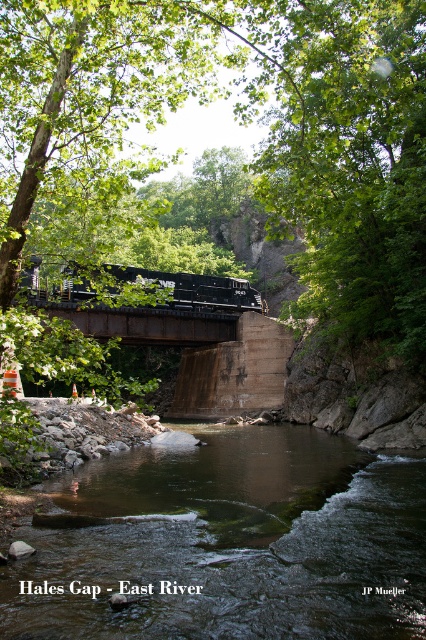
Is green leafy tree at upper center thinner than clear water at center?

No.

Between green leafy tree at upper center and clear water at center, which one is positioned higher?

green leafy tree at upper center is above.

Describe the element at coordinates (244, 116) in the screenshot. I see `green leafy tree at upper center` at that location.

Identify the location of green leafy tree at upper center. (244, 116).

Which is in front, point (324, 166) or point (71, 285)?

Point (324, 166) is more forward.

Does point (158, 99) lie behind point (138, 275)?

No, (158, 99) is closer to viewer.

Consider the image. Who is more distant from viewer, [394,184] or [180,289]?

The point [180,289] is more distant.

The image size is (426, 640). I want to click on green leafy tree at upper center, so click(x=244, y=116).

In the scene shown: Does clear water at center have a greater width compared to black metal train at center?

Incorrect, clear water at center's width does not surpass black metal train at center's.

Describe the element at coordinates (230, 545) in the screenshot. I see `clear water at center` at that location.

Does point (310, 467) come behind point (98, 298)?

No, it is not.

Identify the location of clear water at center. Image resolution: width=426 pixels, height=640 pixels. (230, 545).